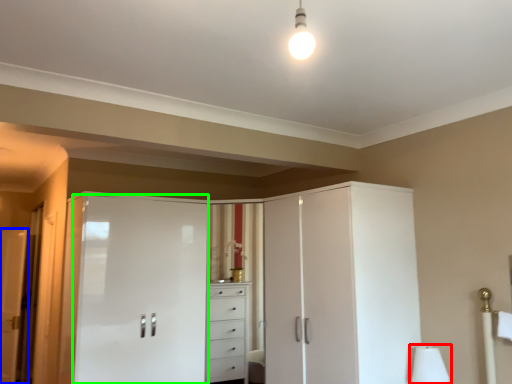
Question: Which object is the farthest from table lamp (highlighted by a red box)? Choose among these: door (highlighted by a blue box) or screen door (highlighted by a green box).

Choices:
 (A) door
 (B) screen door

Answer: (A)